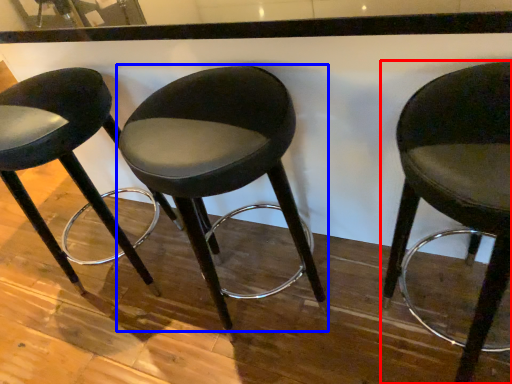
Question: Which point is closer to the camera, chair (highlighted by a red box) or chair (highlighted by a blue box)?

Choices:
 (A) chair
 (B) chair

Answer: (A)